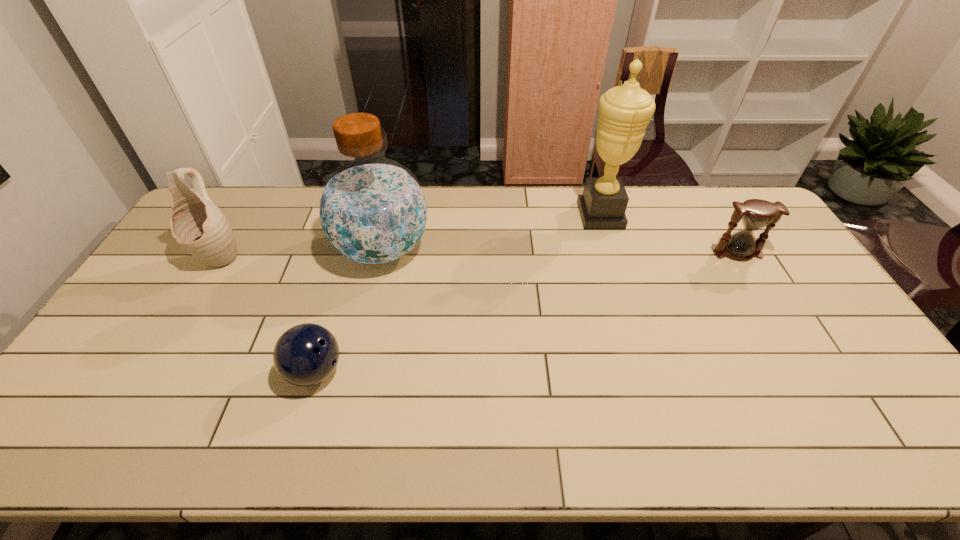
In the image, there is a desktop. Where is `vacant space at the far edge`? vacant space at the far edge is located at coordinates (268, 189).

Locate an element on the screen. The height and width of the screenshot is (540, 960). vacant space at the near edge of the desktop is located at coordinates (746, 447).

Where is `blank space at the left edge of the desktop`? blank space at the left edge of the desktop is located at coordinates (166, 336).

Find the location of a particular element. This screenshot has height=540, width=960. vacant space at the right edge of the desktop is located at coordinates (858, 392).

Find the location of `free spot at the far left corner of the desktop`. free spot at the far left corner of the desktop is located at coordinates (238, 201).

Where is `vacant space that is in between the second tallest object and the bowling ball`? vacant space that is in between the second tallest object and the bowling ball is located at coordinates (348, 310).

Locate an element on the screen. The height and width of the screenshot is (540, 960). vacant region between the pitcher and the second shortest object is located at coordinates (478, 255).

Where is `free space between the nearest object and the second tallest object`? The height and width of the screenshot is (540, 960). free space between the nearest object and the second tallest object is located at coordinates (348, 310).

The image size is (960, 540). I want to click on empty space between the nearest object and the second object from right to left, so click(458, 293).

Locate an element on the screen. The image size is (960, 540). free spot between the water jug and the trophy cup is located at coordinates (492, 233).